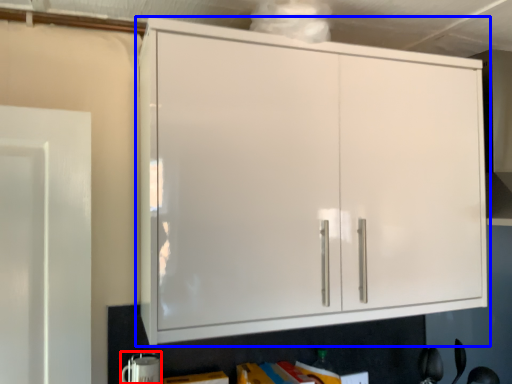
Question: Among these objects, which one is farthest to the camera, appliance (highlighted by a red box) or cupboard (highlighted by a blue box)?

Choices:
 (A) appliance
 (B) cupboard

Answer: (A)